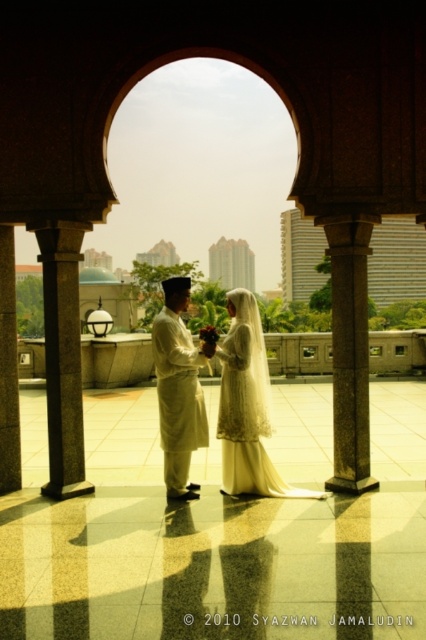
Question: Is beige cotton kurta at center further to the viewer compared to smooth stone pillar at left?

Choices:
 (A) no
 (B) yes

Answer: (A)

Question: Is white lace dress at center to the right of smooth stone pillar at left from the viewer's perspective?

Choices:
 (A) no
 (B) yes

Answer: (B)

Question: Among these objects, which one is nearest to the camera?

Choices:
 (A) beige cotton kurta at center
 (B) brown polished stone pillar at center

Answer: (A)

Question: Which object is positioned farthest from the smooth stone pillar at left?

Choices:
 (A) white lace dress at center
 (B) beige cotton kurta at center
 (C) brown polished stone pillar at center

Answer: (C)

Question: Does beige cotton kurta at center have a lesser width compared to smooth stone pillar at left?

Choices:
 (A) no
 (B) yes

Answer: (A)

Question: Which object is positioned closest to the granite column at left?

Choices:
 (A) brown polished stone pillar at center
 (B) white lace dress at center
 (C) smooth stone pillar at left
 (D) beige cotton kurta at center

Answer: (C)